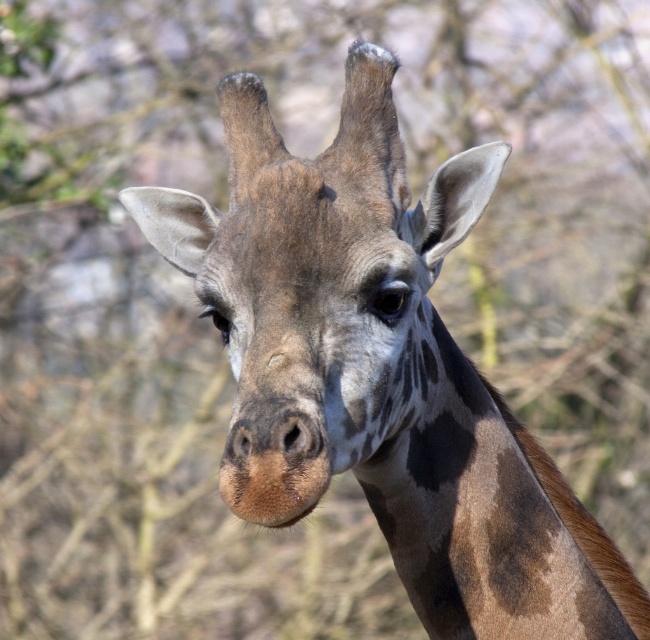
Who is positioned more to the right, brown spotted fur at center or brown spotted neck at center?

From the viewer's perspective, brown spotted neck at center appears more on the right side.

Who is shorter, brown spotted fur at center or brown spotted neck at center?

brown spotted neck at center

Between point (203, 212) and point (416, 611), which one is positioned behind?

Point (203, 212)

Locate an element on the screen. This screenshot has width=650, height=640. brown spotted fur at center is located at coordinates (332, 301).